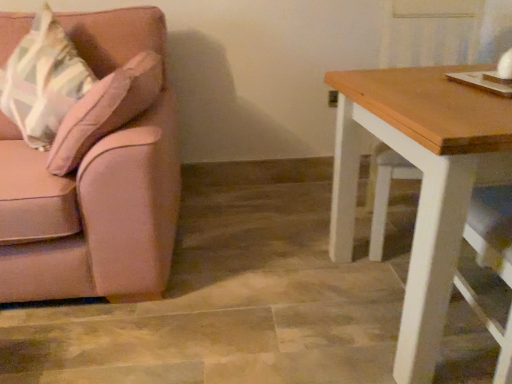
Question: Does wooden table at right have a greater height compared to pink fabric couch at left?

Choices:
 (A) no
 (B) yes

Answer: (A)

Question: Is wooden table at right closer to the viewer compared to pink fabric couch at left?

Choices:
 (A) yes
 (B) no

Answer: (A)

Question: Is there a large distance between wooden table at right and pink fabric couch at left?

Choices:
 (A) yes
 (B) no

Answer: (B)

Question: Does wooden table at right have a smaller size compared to pink fabric couch at left?

Choices:
 (A) no
 (B) yes

Answer: (B)

Question: From the image's perspective, is wooden table at right beneath pink fabric couch at left?

Choices:
 (A) yes
 (B) no

Answer: (A)

Question: Is pink fabric couch at left inside or outside of wooden table at right?

Choices:
 (A) inside
 (B) outside

Answer: (B)

Question: Considering the positions of pink fabric couch at left and wooden table at right in the image, is pink fabric couch at left taller or shorter than wooden table at right?

Choices:
 (A) tall
 (B) short

Answer: (A)

Question: Looking at the image, does pink fabric couch at left seem bigger or smaller compared to wooden table at right?

Choices:
 (A) big
 (B) small

Answer: (A)

Question: Considering the positions of pink fabric couch at left and wooden table at right in the image, is pink fabric couch at left wider or thinner than wooden table at right?

Choices:
 (A) thin
 (B) wide

Answer: (B)

Question: From a real-world perspective, relative to wooden table at right, is matte pink throw pillow at left vertically above or below?

Choices:
 (A) above
 (B) below

Answer: (A)

Question: Based on their sizes in the image, would you say matte pink throw pillow at left is bigger or smaller than wooden table at right?

Choices:
 (A) small
 (B) big

Answer: (A)

Question: Considering the relative positions of matte pink throw pillow at left and wooden table at right in the image provided, is matte pink throw pillow at left to the left or to the right of wooden table at right?

Choices:
 (A) right
 (B) left

Answer: (B)

Question: Is matte pink throw pillow at left inside the boundaries of wooden table at right, or outside?

Choices:
 (A) outside
 (B) inside

Answer: (A)

Question: From their relative heights in the image, would you say matte pink throw pillow at left is taller or shorter than pink fabric couch at left?

Choices:
 (A) tall
 (B) short

Answer: (B)

Question: Considering their positions, is matte pink throw pillow at left located in front of or behind pink fabric couch at left?

Choices:
 (A) front
 (B) behind

Answer: (B)